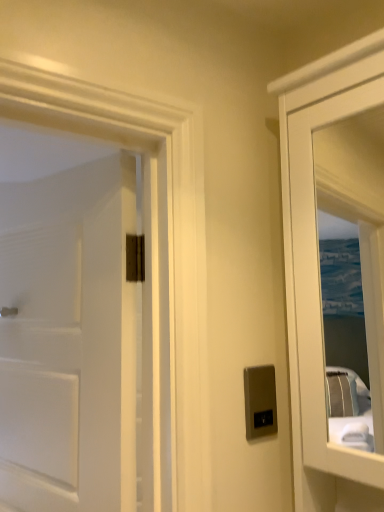
The image size is (384, 512). Describe the element at coordinates (68, 340) in the screenshot. I see `white matte door at left` at that location.

Find the location of a particular element. This screenshot has width=384, height=512. white matte door at left is located at coordinates (68, 340).

The width and height of the screenshot is (384, 512). What do you see at coordinates (260, 401) in the screenshot?
I see `satin silver switch at center` at bounding box center [260, 401].

Find the location of a particular element. The height and width of the screenshot is (512, 384). satin silver switch at center is located at coordinates (260, 401).

Measure the distance between point (254, 433) and camera.

The distance of point (254, 433) from camera is 35.20 inches.

This screenshot has height=512, width=384. Identify the location of white matte door at left. (68, 340).

Based on the photo, can you confirm if white matte door at left is positioned to the left of satin silver switch at center?

Yes, white matte door at left is to the left of satin silver switch at center.

Is white matte door at left behind satin silver switch at center?

No, the depth of white matte door at left is less than that of satin silver switch at center.

Which is behind, point (85, 508) or point (252, 436)?

The point (85, 508) is farther.

From the image's perspective, is white matte door at left positioned above or below satin silver switch at center?

From the image's perspective, white matte door at left appears above satin silver switch at center.

From the picture: From a real-world perspective, which is physically above, white matte door at left or satin silver switch at center?

white matte door at left is physically above.

Between white matte door at left and satin silver switch at center, which one has smaller width?

satin silver switch at center.

In terms of height, does white matte door at left look taller or shorter compared to satin silver switch at center?

Clearly, white matte door at left is taller compared to satin silver switch at center.

Which of these two, white matte door at left or satin silver switch at center, is smaller?

Smaller between the two is satin silver switch at center.

Would you say satin silver switch at center is part of white matte door at left's contents?

That's incorrect, satin silver switch at center is not inside white matte door at left.

Consider the image. Is white matte door at left not close to satin silver switch at center?

No, white matte door at left is not far away from satin silver switch at center.

Does white matte door at left turn towards satin silver switch at center?

No, white matte door at left is not facing towards satin silver switch at center.

How many degrees apart are the facing directions of white matte door at left and satin silver switch at center?

72.8 degrees separate the facing orientations of white matte door at left and satin silver switch at center.

How far apart are white matte door at left and satin silver switch at center?

They are 18.72 inches apart.

This screenshot has width=384, height=512. Find the location of `electric outlet located behind the white matte door at left`. electric outlet located behind the white matte door at left is located at coordinates (260, 401).

Can you confirm if satin silver switch at center is positioned to the left of white matte door at left?

Incorrect, satin silver switch at center is not on the left side of white matte door at left.

Is satin silver switch at center positioned before white matte door at left?

No, satin silver switch at center is further to the viewer.

Which is closer to the camera, (266, 398) or (78, 199)?

Point (266, 398).

From the image's perspective, relative to white matte door at left, is satin silver switch at center above or below?

Clearly, from the image's perspective, satin silver switch at center is below white matte door at left.

From a real-world perspective, who is located higher, satin silver switch at center or white matte door at left?

In real-world perspective, white matte door at left is above.

Considering the sizes of satin silver switch at center and white matte door at left in the image, is satin silver switch at center wider or thinner than white matte door at left?

In the image, satin silver switch at center appears to be more narrow than white matte door at left.

Considering the relative sizes of satin silver switch at center and white matte door at left in the image provided, is satin silver switch at center taller than white matte door at left?

No, satin silver switch at center is not taller than white matte door at left.

Which of these two, satin silver switch at center or white matte door at left, is smaller?

Smaller between the two is satin silver switch at center.

Could white matte door at left be considered to be inside satin silver switch at center?

That's incorrect, white matte door at left is not inside satin silver switch at center.

Consider the image. Would you say satin silver switch at center is a long distance from white matte door at left?

No, satin silver switch at center is not far from white matte door at left.

Is satin silver switch at center oriented towards white matte door at left?

No, satin silver switch at center does not turn towards white matte door at left.

Identify the location of door that is on the left side of satin silver switch at center. (68, 340).

The width and height of the screenshot is (384, 512). Find the location of `door that appears above the satin silver switch at center (from the image's perspective)`. door that appears above the satin silver switch at center (from the image's perspective) is located at coordinates (68, 340).

Find the location of a particular element. This screenshot has width=384, height=512. door lying on the left of satin silver switch at center is located at coordinates (68, 340).